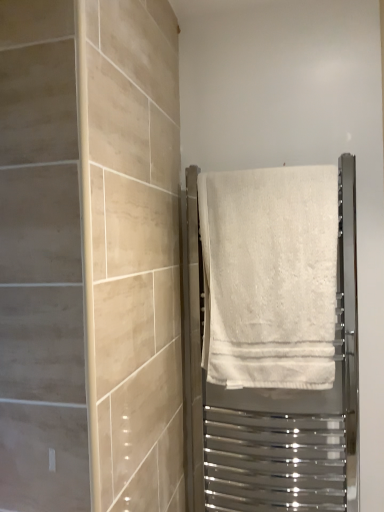
The width and height of the screenshot is (384, 512). What do you see at coordinates (269, 276) in the screenshot? I see `white cotton towel at center` at bounding box center [269, 276].

At what (x,y) coordinates should I click in order to perform the action: click on white cotton towel at center. Please return your answer as a coordinate pair (x, y). Looking at the image, I should click on (269, 276).

Locate an element on the screen. The image size is (384, 512). white cotton towel at center is located at coordinates (269, 276).